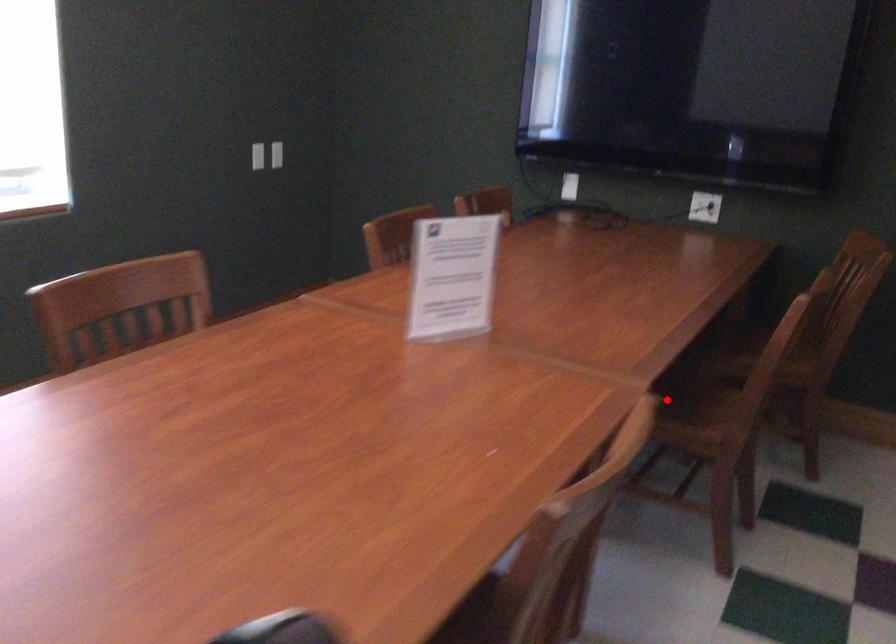
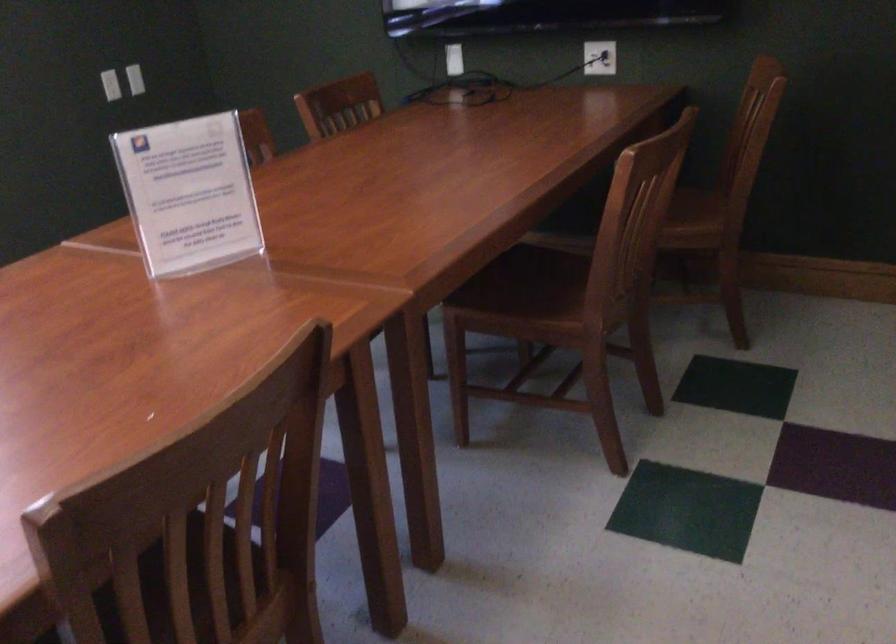
Question: I am providing you with two images of the same scene from different viewpoints. Given a red point in image1, look at the same physical point in image2. Is it:

Choices:
 (A) Closer to the viewpoint
 (B) Farther from the viewpoint

Answer: (A)